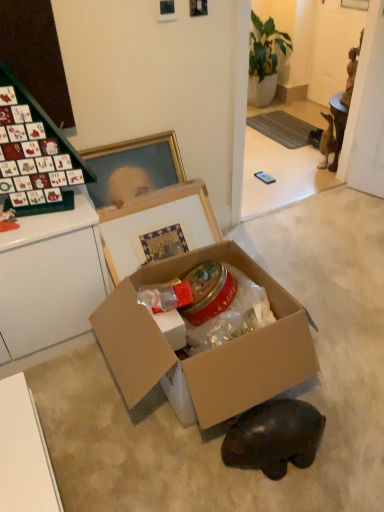
I want to click on free space to the left of shiny black bear at lower center, the 2th animal from the right, so click(190, 466).